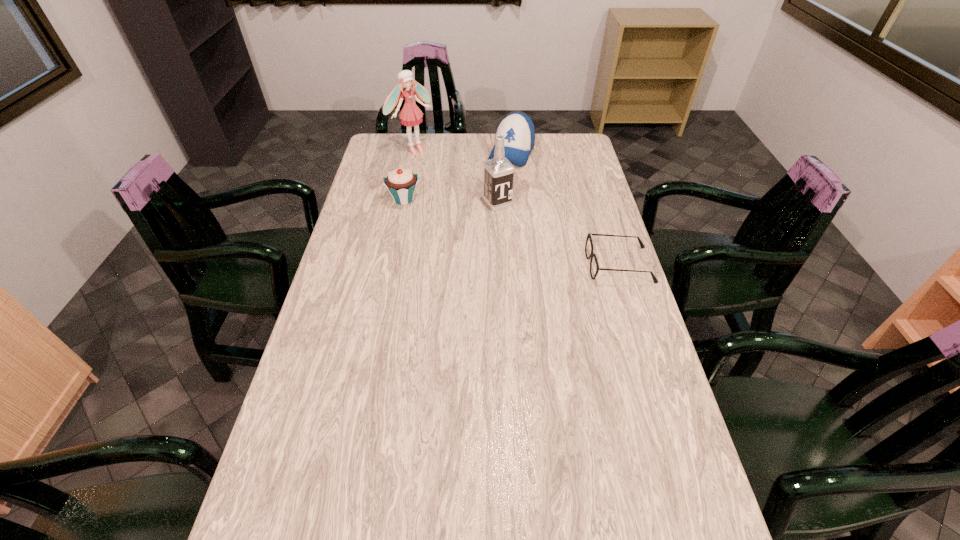
Where is `vacant space that satisfies the following two spatial constraints: 1. on the front side of the baseball cap; 2. with the lenses facing outward on the spectacles`? The height and width of the screenshot is (540, 960). vacant space that satisfies the following two spatial constraints: 1. on the front side of the baseball cap; 2. with the lenses facing outward on the spectacles is located at coordinates (522, 265).